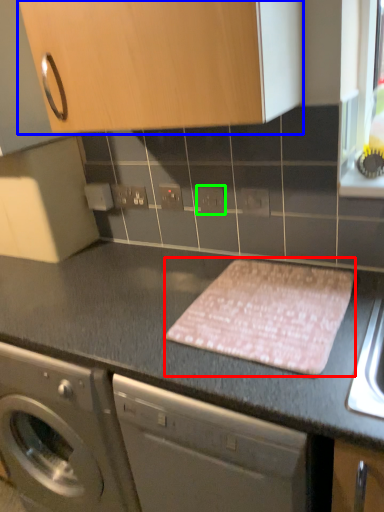
Question: Based on their relative distances, which object is farther from blanket (highlighted by a red box)? Choose from cabinetry (highlighted by a blue box) and electric outlet (highlighted by a green box).

Choices:
 (A) cabinetry
 (B) electric outlet

Answer: (A)